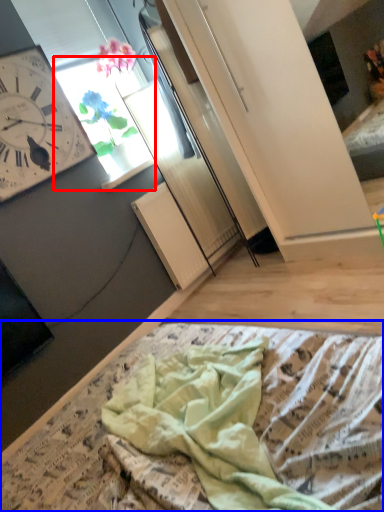
Question: Which point is closer to the camera, window (highlighted by a red box) or blanket (highlighted by a blue box)?

Choices:
 (A) window
 (B) blanket

Answer: (B)